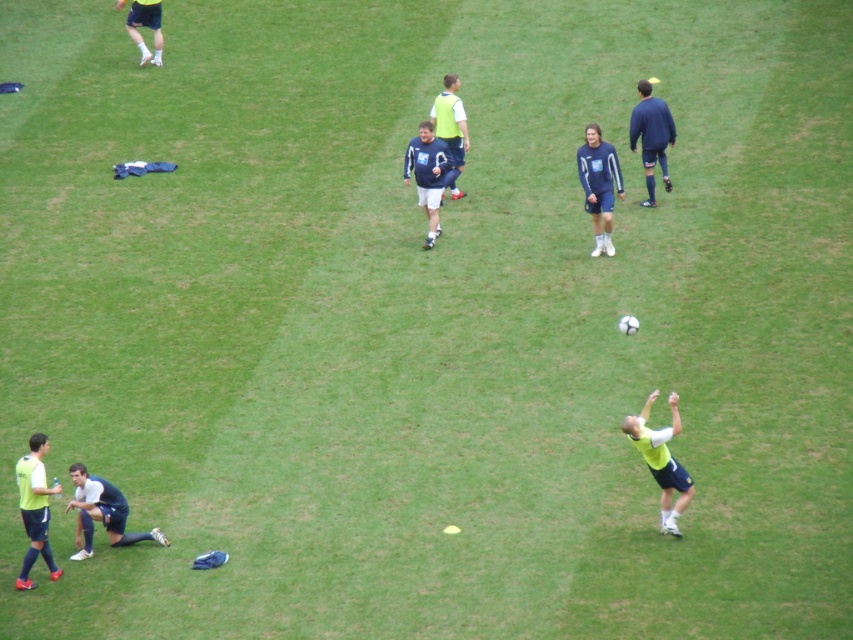
Question: Can you confirm if dark blue uniform at lower left is bigger than matte blue shirt at center?

Choices:
 (A) no
 (B) yes

Answer: (A)

Question: Is matte green shorts at lower left to the right of light green jersey at center from the viewer's perspective?

Choices:
 (A) yes
 (B) no

Answer: (B)

Question: Which of the following is the closest to the observer?

Choices:
 (A) (436, 112)
 (B) (120, 1)
 (C) (85, 515)
 (D) (38, 440)

Answer: (D)

Question: Which point is farther to the camera?

Choices:
 (A) matte blue shirt at center
 (B) dark blue jersey at upper right
 (C) dark blue uniform at lower left

Answer: (B)

Question: Does dark blue jersey at upper right have a smaller size compared to matte blue shorts at upper left?

Choices:
 (A) no
 (B) yes

Answer: (A)

Question: Which point appears closest to the camera in this image?

Choices:
 (A) (647, 118)
 (B) (602, 202)

Answer: (B)